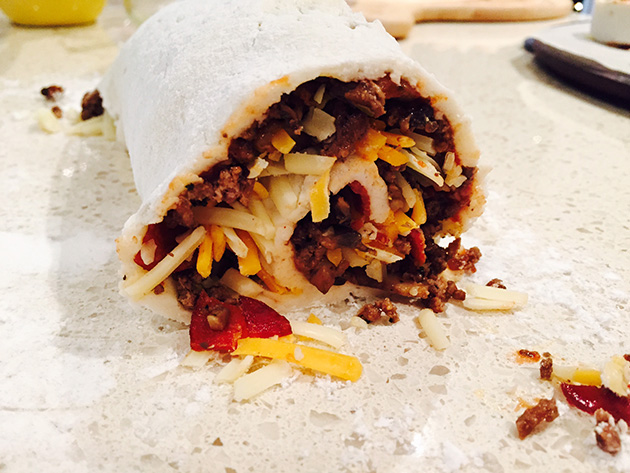
Identify the location of marble. (550, 255).